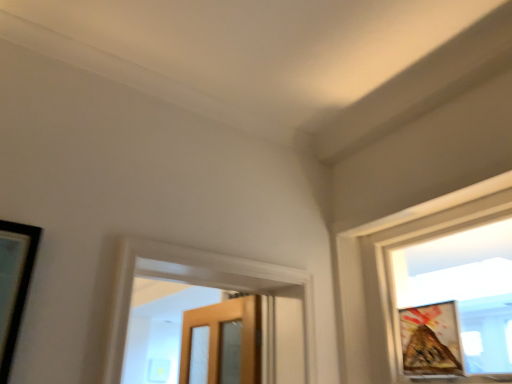
Question: In terms of width, does matte glass window at upper right look wider or thinner when compared to wooden textured picture frame at right?

Choices:
 (A) thin
 (B) wide

Answer: (B)

Question: From the image's perspective, relative to wooden textured picture frame at right, is matte glass window at upper right above or below?

Choices:
 (A) below
 (B) above

Answer: (B)

Question: From a real-world perspective, is matte glass window at upper right above or below wooden textured picture frame at right?

Choices:
 (A) above
 (B) below

Answer: (A)

Question: Which is correct: wooden textured picture frame at right is inside matte glass window at upper right, or outside of it?

Choices:
 (A) outside
 (B) inside

Answer: (B)

Question: Considering their positions, is wooden textured picture frame at right located in front of or behind matte glass window at upper right?

Choices:
 (A) front
 (B) behind

Answer: (B)

Question: In terms of width, does wooden textured picture frame at right look wider or thinner when compared to matte glass window at upper right?

Choices:
 (A) wide
 (B) thin

Answer: (B)

Question: Considering the relative positions of wooden textured picture frame at right and matte glass window at upper right in the image provided, is wooden textured picture frame at right to the left or to the right of matte glass window at upper right?

Choices:
 (A) left
 (B) right

Answer: (A)